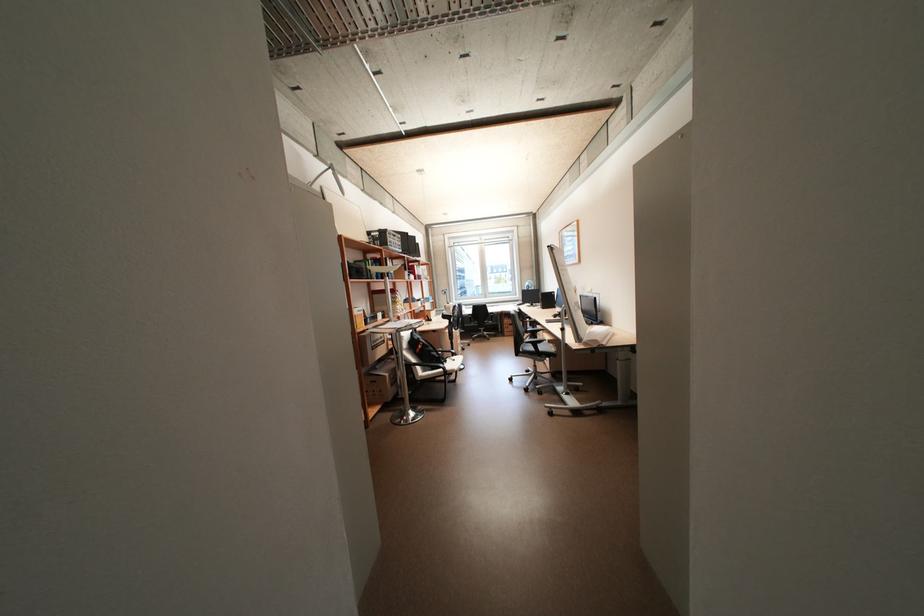
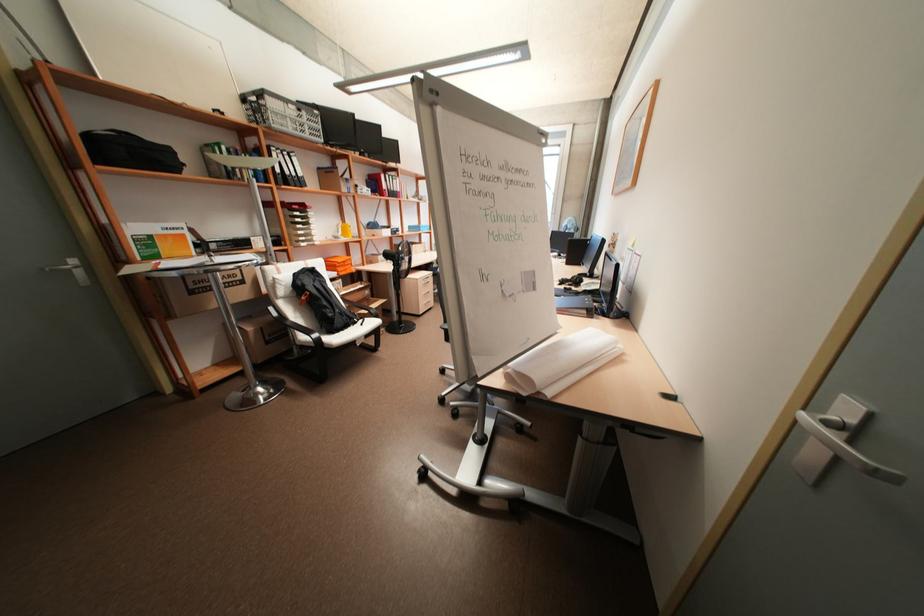
Where in the second image is the point corresponding to (374,233) from the first image?

(249, 99)